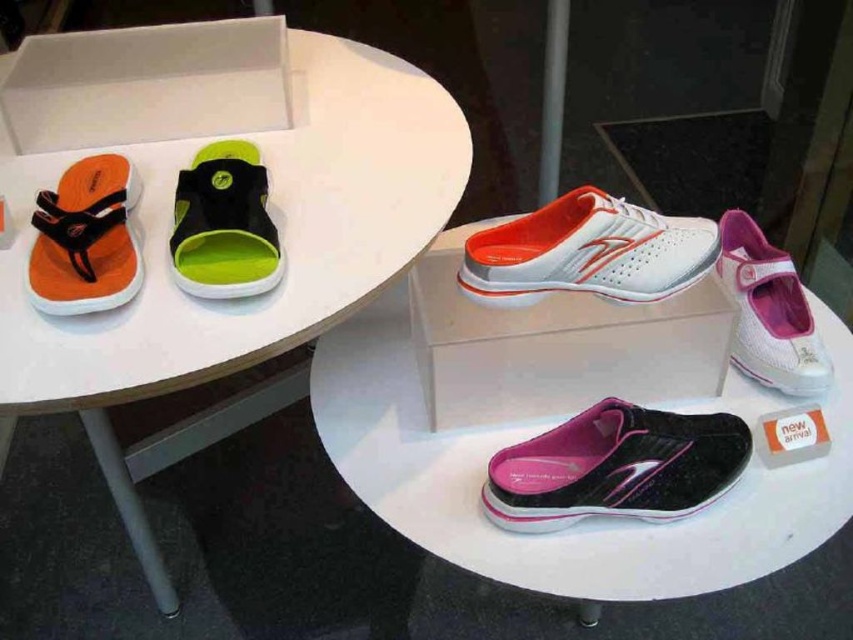
Is point (154, 362) in front of point (630, 422)?

Yes, it is in front of point (630, 422).

Does white plastic table at upper left have a larger size compared to shiny black running shoe at lower center?

Yes, white plastic table at upper left is bigger than shiny black running shoe at lower center.

Who is more distant from viewer, (136,93) or (625,412)?

The point (136,93) is more distant.

Locate an element on the screen. This screenshot has width=853, height=640. white plastic table at upper left is located at coordinates (172, 208).

Based on the photo, does transparent plastic shoe at center appear on the left side of white matte slip-on shoe at center?

Yes, transparent plastic shoe at center is to the left of white matte slip-on shoe at center.

Is transparent plastic shoe at center taller than white matte slip-on shoe at center?

Correct, transparent plastic shoe at center is much taller as white matte slip-on shoe at center.

Between point (546, 394) and point (556, 288), which one is positioned behind?

The point (546, 394) is behind.

At what (x,y) coordinates should I click in order to perform the action: click on transparent plastic shoe at center. Please return your answer as a coordinate pair (x, y). Image resolution: width=853 pixels, height=640 pixels. Looking at the image, I should click on (555, 346).

Can you confirm if transparent plastic shoe at center is smaller than orange matte sandal at left?

Incorrect, transparent plastic shoe at center is not smaller in size than orange matte sandal at left.

Can you confirm if transparent plastic shoe at center is bigger than orange matte sandal at left?

Yes.

Image resolution: width=853 pixels, height=640 pixels. Identify the location of transparent plastic shoe at center. (555, 346).